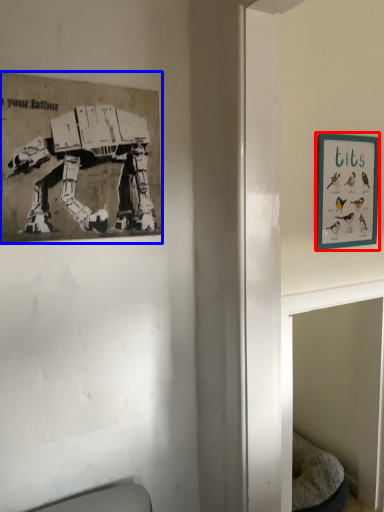
Question: Which object appears farthest to the camera in this image, picture frame (highlighted by a red box) or picture frame (highlighted by a blue box)?

Choices:
 (A) picture frame
 (B) picture frame

Answer: (A)